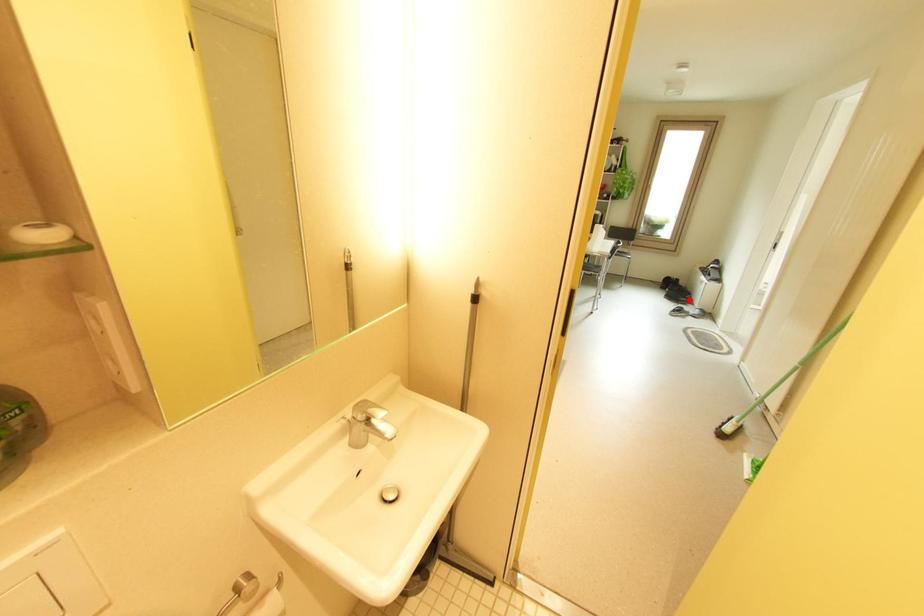
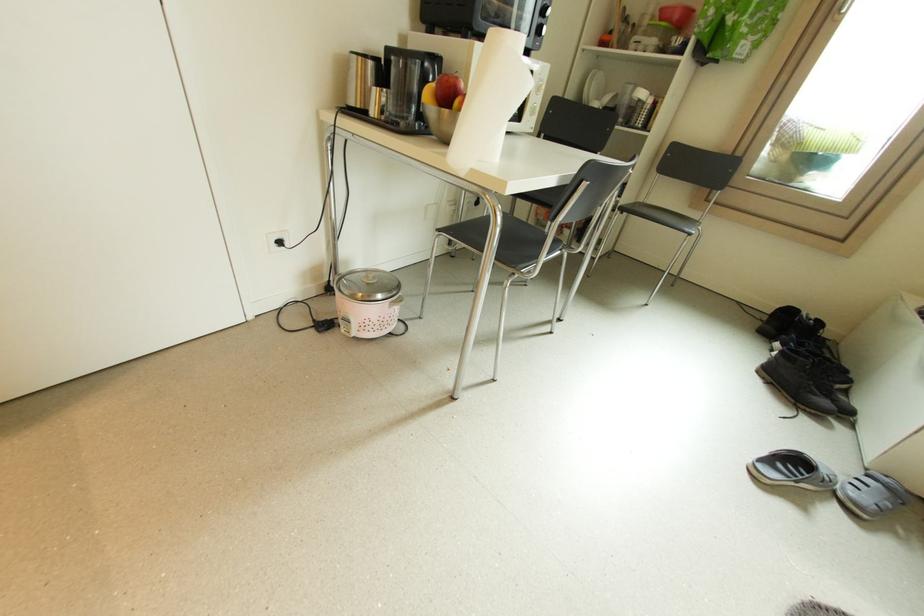
Where in the second image is the point corresponding to the highlighted location from the first image?

(830, 403)